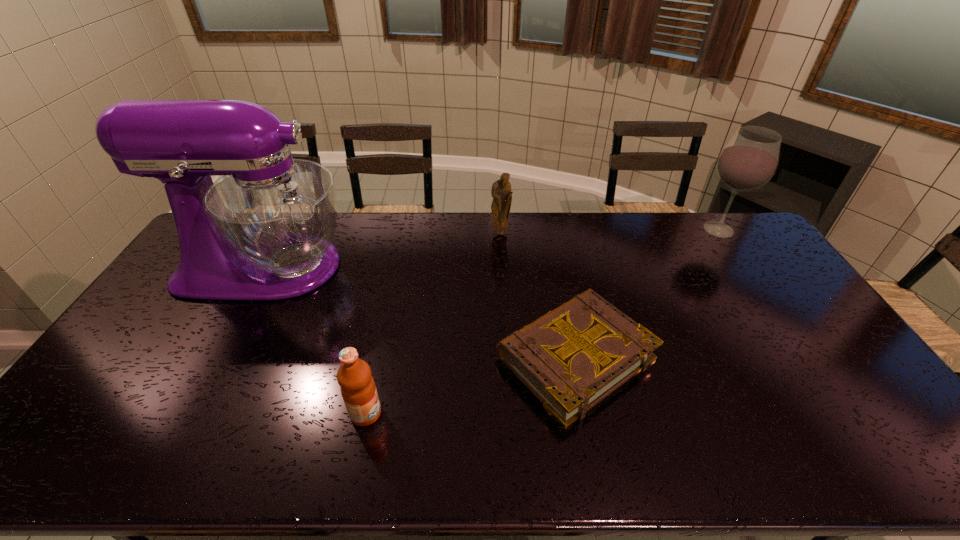
Image resolution: width=960 pixels, height=540 pixels. I want to click on the tallest object, so click(x=264, y=231).

The height and width of the screenshot is (540, 960). In order to click on mixer in this screenshot , I will do `click(264, 231)`.

I want to click on the rightmost object, so click(x=749, y=160).

Identify the location of the second tallest object. (749, 160).

Locate an element on the screen. The height and width of the screenshot is (540, 960). figurine is located at coordinates (501, 192).

Locate an element on the screen. fruit juice is located at coordinates (358, 389).

Find the location of a particular element. The width and height of the screenshot is (960, 540). hardback book is located at coordinates (571, 358).

This screenshot has width=960, height=540. Find the location of `vacant space located at the bowl opening of the tallest object`. vacant space located at the bowl opening of the tallest object is located at coordinates (400, 267).

You are a GUI agent. You are given a task and a screenshot of the screen. Output one action in this format:
    pyautogui.click(x=<x>, y=<y>)
    Task: Click on the vacant area situated on the front of the alcohol
    This screenshot has width=960, height=540.
    Given the screenshot: What is the action you would take?
    pyautogui.click(x=762, y=294)

Where is `vacant space located 0.400m on the front-facing side of the figurine`? vacant space located 0.400m on the front-facing side of the figurine is located at coordinates (505, 314).